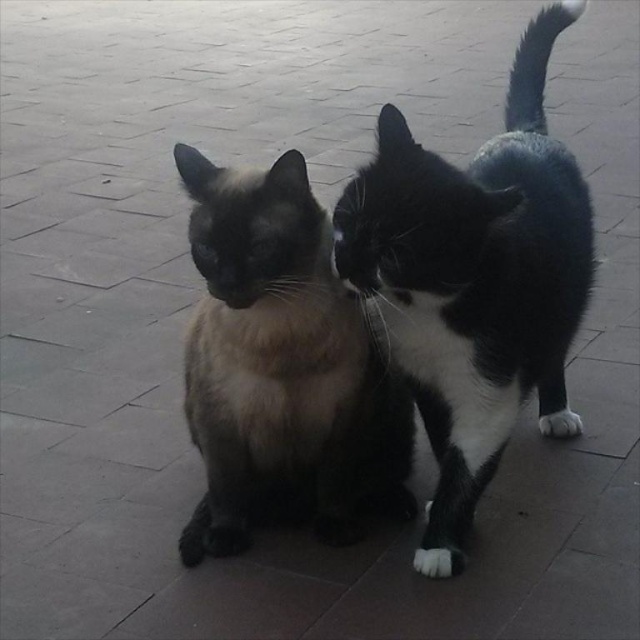
Can you confirm if black and white fur cat at right is wider than smokey fur cat at center?

Correct, the width of black and white fur cat at right exceeds that of smokey fur cat at center.

Which is in front, point (429, 413) or point (211, 470)?

Point (211, 470) is in front.

Locate an element on the screen. The height and width of the screenshot is (640, 640). black and white fur cat at right is located at coordinates (474, 282).